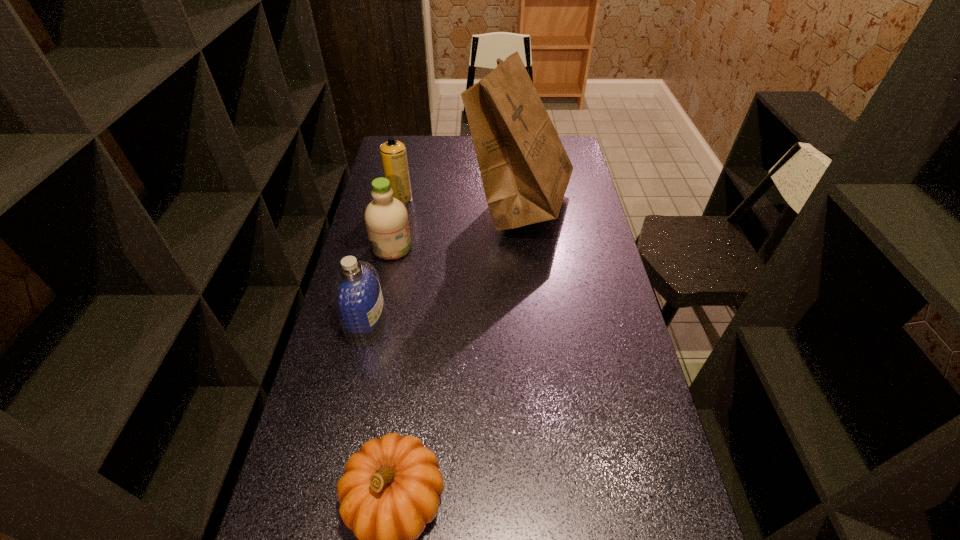
Locate an element on the screen. This screenshot has width=960, height=540. grocery bag is located at coordinates (525, 170).

Image resolution: width=960 pixels, height=540 pixels. What are the coordinates of `the tallest object` in the screenshot? It's located at (525, 170).

What are the coordinates of `the farther cleansing agent` in the screenshot? It's located at (386, 218).

I want to click on aerosol can, so (x=393, y=153).

Identify the location of the fourth farthest object. (356, 291).

I want to click on free space located 0.050m on the right of the rightmost object, so click(x=588, y=204).

At what (x,y) coordinates should I click in order to perform the action: click on vacant space located 0.400m on the front label of the farther cleansing agent. Please return your answer as a coordinate pair (x, y). Image resolution: width=960 pixels, height=540 pixels. Looking at the image, I should click on (522, 247).

You are a GUI agent. You are given a task and a screenshot of the screen. Output one action in this format:
    pyautogui.click(x=<x>, y=<y>)
    Task: Click on the vacant space located 0.280m on the front of the aerosol can
    
    Given the screenshot: What is the action you would take?
    pyautogui.click(x=389, y=253)

This screenshot has height=540, width=960. Find the location of `free space located on the back of the nearer cleansing agent`. free space located on the back of the nearer cleansing agent is located at coordinates (382, 255).

Locate an element on the screen. aerosol can that is at the left edge is located at coordinates (393, 153).